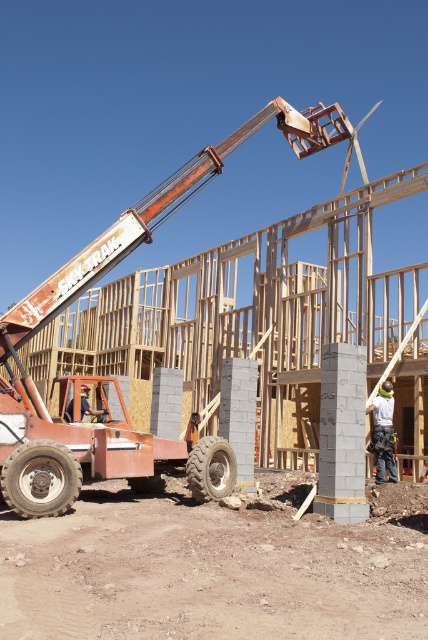
You are a construction worker on the construction site. You need to locate the orange metallic crane at center. Can you tell me where exactly the point with coordinates point (113, 376) is located?

The point (113, 376) is located on the orange metallic crane at center.

From the picture: Based on the scene description, where is the orange metallic crane at center located in the image?

The orange metallic crane at center is located at point coordinates of 0.589 on the x axis and 0.266 on the y axis.

You are a safety inspector at the construction site. You need to ensure that the orange metallic crane at center and the white hard hat at center are placed safely. According to safety regulations, the crane must be at least 2 meters taller than the hard hat. Is this requirement met?

The orange metallic crane at center is taller than the white hard hat at center, so the requirement is met.